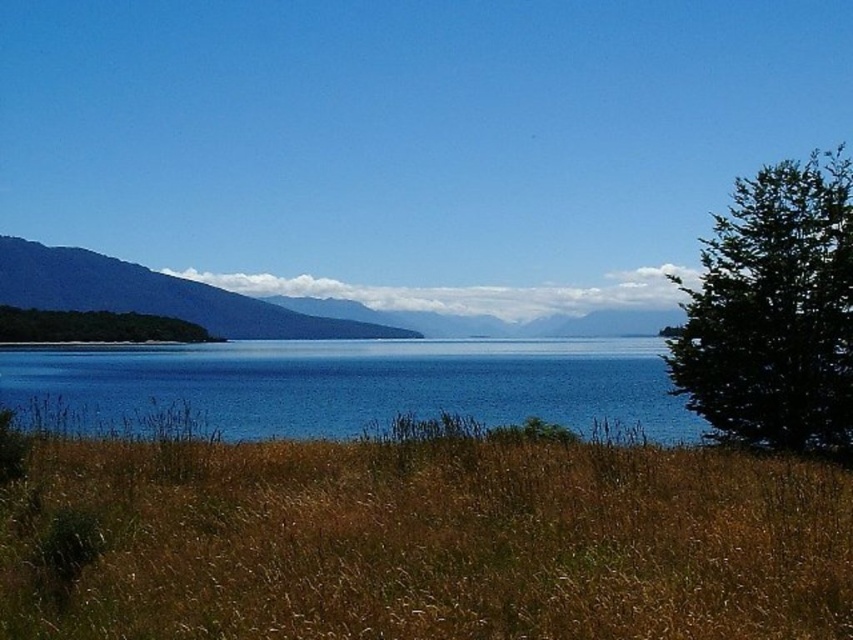
Question: Is blue water at center bigger than green forested mountain at left?

Choices:
 (A) yes
 (B) no

Answer: (B)

Question: Which point is closer to the camera?

Choices:
 (A) green leafy tree at left
 (B) green forested mountain at left
 (C) green leafy tree at right
 (D) blue water at center

Answer: (D)

Question: Estimate the real-world distances between objects in this image. Which object is closer to the green leafy tree at left?

Choices:
 (A) brown dry grass at lower center
 (B) blue water at center
 (C) green forested mountain at left
 (D) green leafy tree at right

Answer: (C)

Question: Can you confirm if brown dry grass at lower center is positioned below green forested mountain at left?

Choices:
 (A) no
 (B) yes

Answer: (B)

Question: Where is brown dry grass at lower center located in relation to green leafy tree at right in the image?

Choices:
 (A) above
 (B) below

Answer: (B)

Question: Which of the following is the farthest from the observer?

Choices:
 (A) blue water at center
 (B) green leafy tree at left
 (C) green forested mountain at left

Answer: (C)